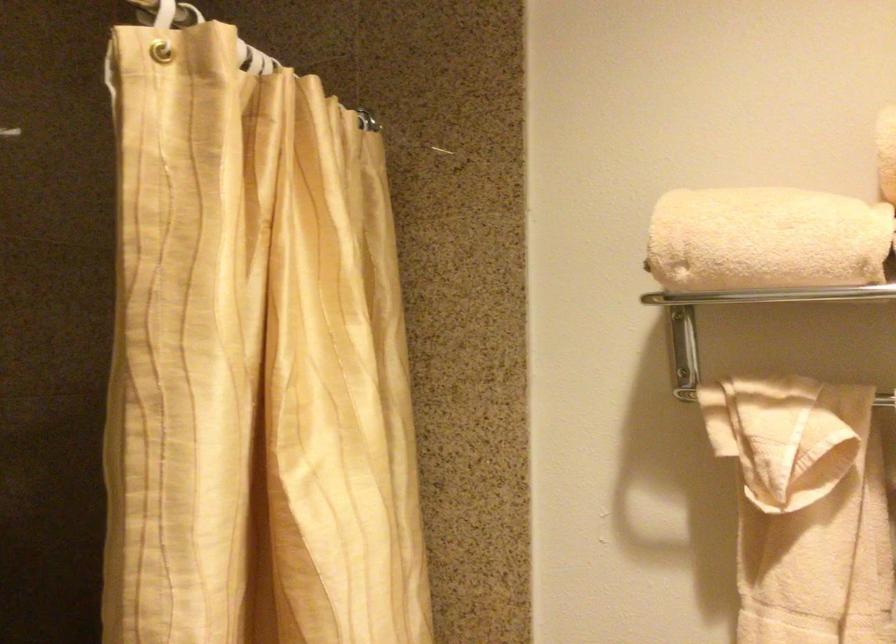
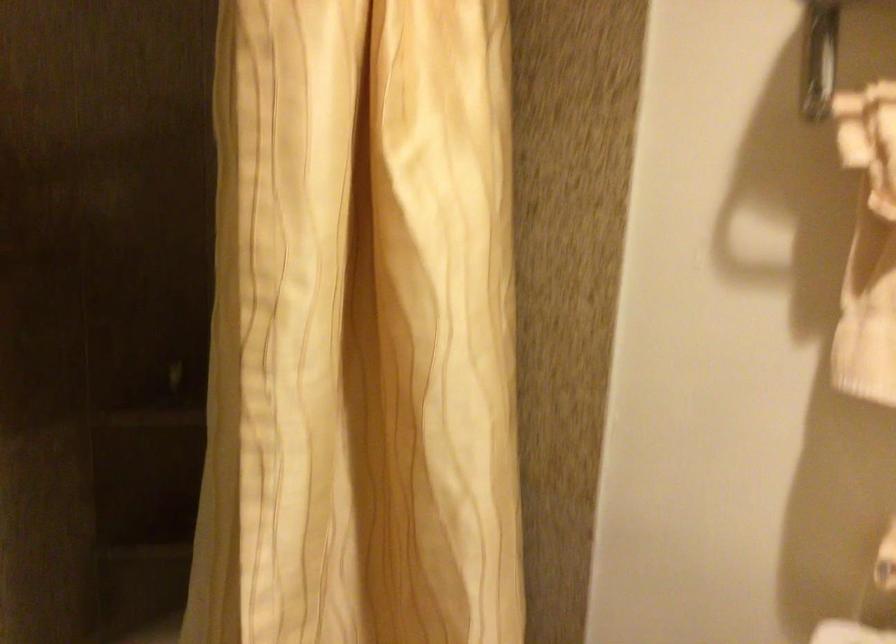
Question: The images are taken continuously from a first-person perspective. In which direction is your viewpoint rotating?

Choices:
 (A) Left
 (B) Right
 (C) Up
 (D) Down

Answer: (D)